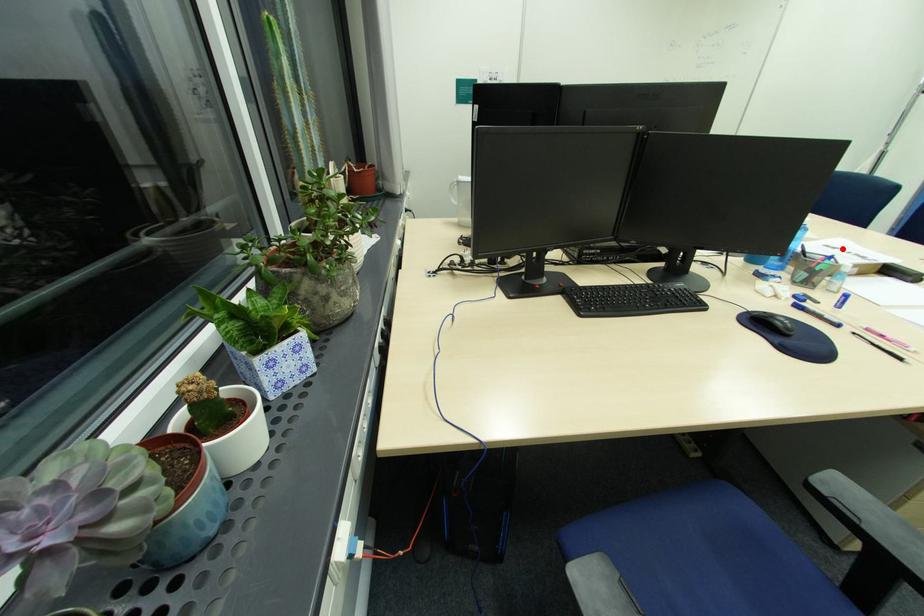
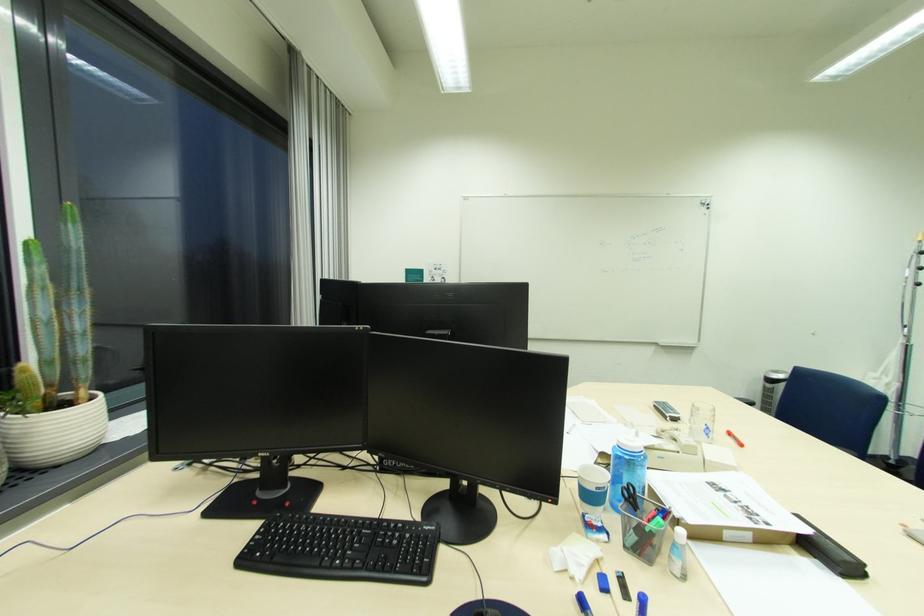
Question: I am providing you with two images of the same scene from different viewpoints. Image1 has a red point marked. In image2, the corresponding 3D location appears at what relative position? Reply with the corresponding letter.

Choices:
 (A) Closer
 (B) Farther

Answer: (B)